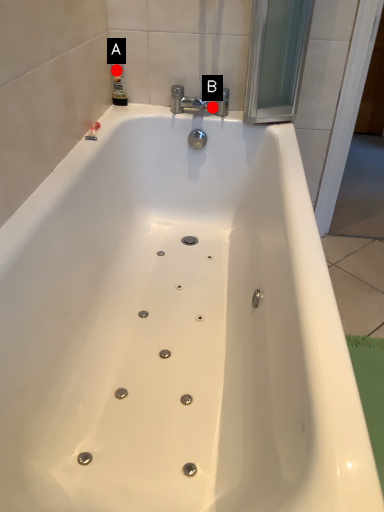
Question: Two points are circled on the image, labeled by A and B beside each circle. Among these points, which one is nearest to the camera?

Choices:
 (A) A is closer
 (B) B is closer

Answer: (B)